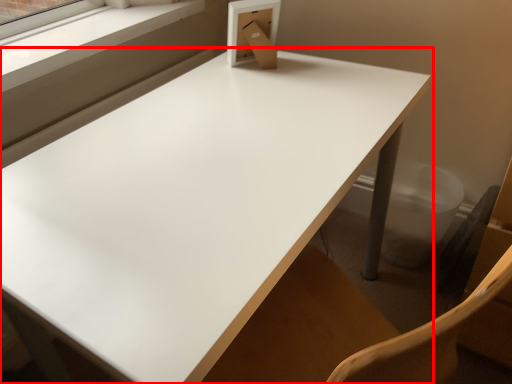
Question: From the image's perspective, what is the correct spatial positioning of table (annotated by the red box) in reference to window frame?

Choices:
 (A) above
 (B) below

Answer: (B)